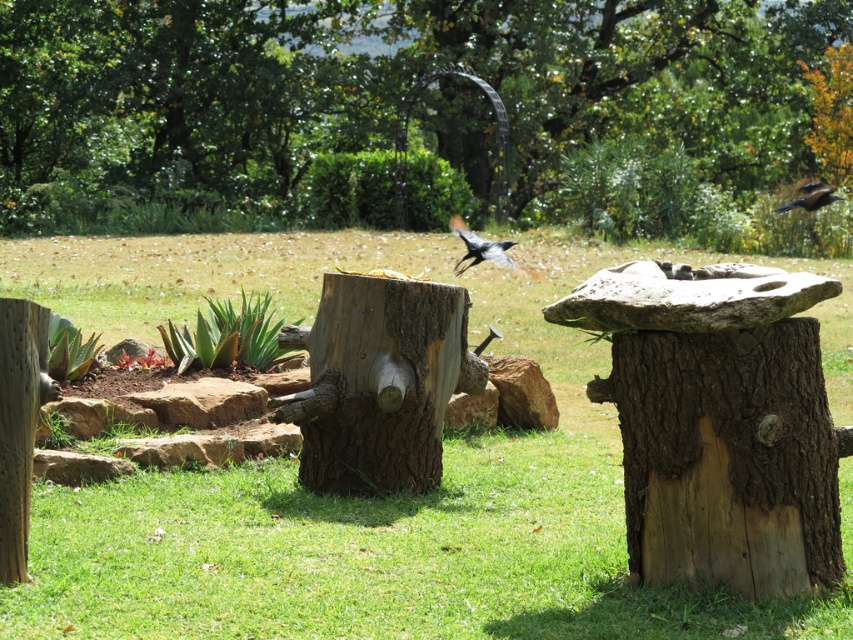
This screenshot has height=640, width=853. I want to click on green grass at center, so click(x=357, y=497).

Who is positioned more to the left, green grass at center or brown rough tree stump at center?

From the viewer's perspective, brown rough tree stump at center appears more on the left side.

Is point (38, 525) more distant than point (337, 412)?

No, it is in front of (337, 412).

Identify the location of green grass at center. [x=357, y=497].

Is shiny black bird at center taller than shiny black bird at upper right?

Correct, shiny black bird at center is much taller as shiny black bird at upper right.

Which is in front, point (476, 259) or point (824, 184)?

Positioned in front is point (476, 259).

Image resolution: width=853 pixels, height=640 pixels. What do you see at coordinates (479, 246) in the screenshot?
I see `shiny black bird at center` at bounding box center [479, 246].

The width and height of the screenshot is (853, 640). I want to click on shiny black bird at center, so click(x=479, y=246).

What do you see at coordinates (378, 381) in the screenshot? I see `brown rough tree stump at center` at bounding box center [378, 381].

Image resolution: width=853 pixels, height=640 pixels. What do you see at coordinates (378, 381) in the screenshot? I see `brown rough tree stump at center` at bounding box center [378, 381].

This screenshot has height=640, width=853. I want to click on brown rough tree stump at center, so click(x=378, y=381).